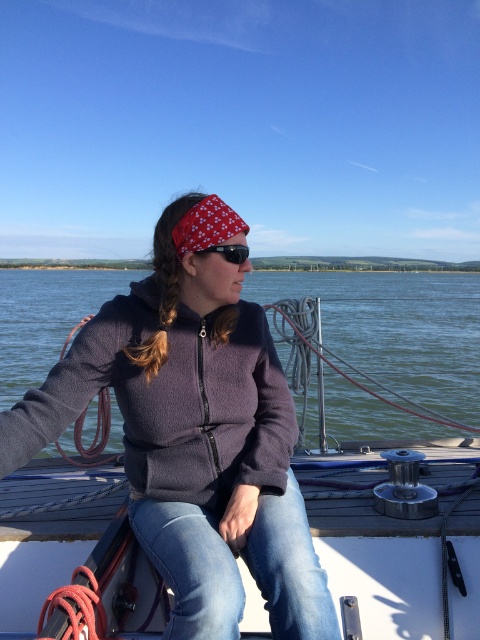
Question: Is red dotted bandana at center closer to camera compared to black matte sunglasses at center?

Choices:
 (A) no
 (B) yes

Answer: (B)

Question: Is dark gray fleece jacket at center to the left of black matte sunglasses at center from the viewer's perspective?

Choices:
 (A) no
 (B) yes

Answer: (B)

Question: Which object is the closest to the green water at center?

Choices:
 (A) black matte sunglasses at center
 (B) dark gray fleece jacket at center

Answer: (B)

Question: Which point is closer to the camera?

Choices:
 (A) dark gray fleece jacket at center
 (B) green water at center
 (C) red dotted bandana at center
 (D) black matte sunglasses at center

Answer: (A)

Question: Does red dotted bandana at center have a smaller size compared to black matte sunglasses at center?

Choices:
 (A) no
 (B) yes

Answer: (A)

Question: Which object is the farthest from the dark gray fleece jacket at center?

Choices:
 (A) green water at center
 (B) red dotted bandana at center

Answer: (A)